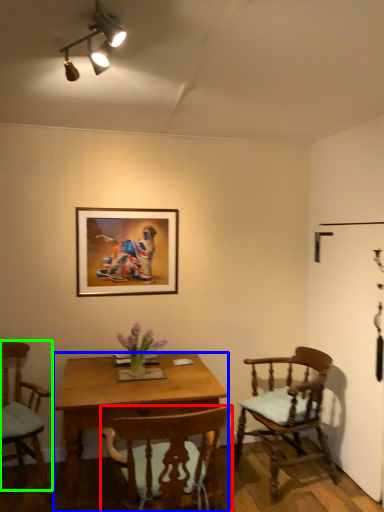
Question: Which object is the closest to the chair (highlighted by a red box)? Choose among these: desk (highlighted by a blue box) or chair (highlighted by a green box).

Choices:
 (A) desk
 (B) chair

Answer: (A)